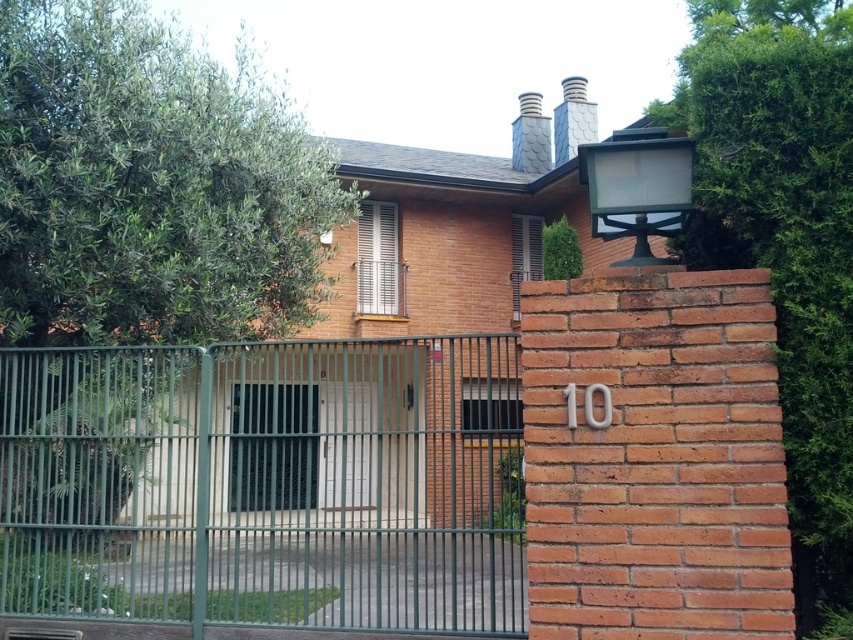
Question: Which object is farther from the camera taking this photo?

Choices:
 (A) green leafy tree at left
 (B) green leafy tree at right

Answer: (A)

Question: Is green leafy tree at right bigger than white glossy door at center?

Choices:
 (A) yes
 (B) no

Answer: (A)

Question: Which is nearer to the green leafy tree at right?

Choices:
 (A) white glossy door at center
 (B) green metal fence at center
 (C) green leafy tree at left

Answer: (C)

Question: Is green metal fence at center positioned behind green leafy tree at left?

Choices:
 (A) no
 (B) yes

Answer: (B)

Question: Which point appears closest to the camera in this image?

Choices:
 (A) (265, 609)
 (B) (705, 129)
 (C) (346, 468)
 (D) (111, 442)

Answer: (B)

Question: Observing the image, what is the correct spatial positioning of green metal fence at center in reference to green leafy tree at left?

Choices:
 (A) below
 (B) above

Answer: (A)